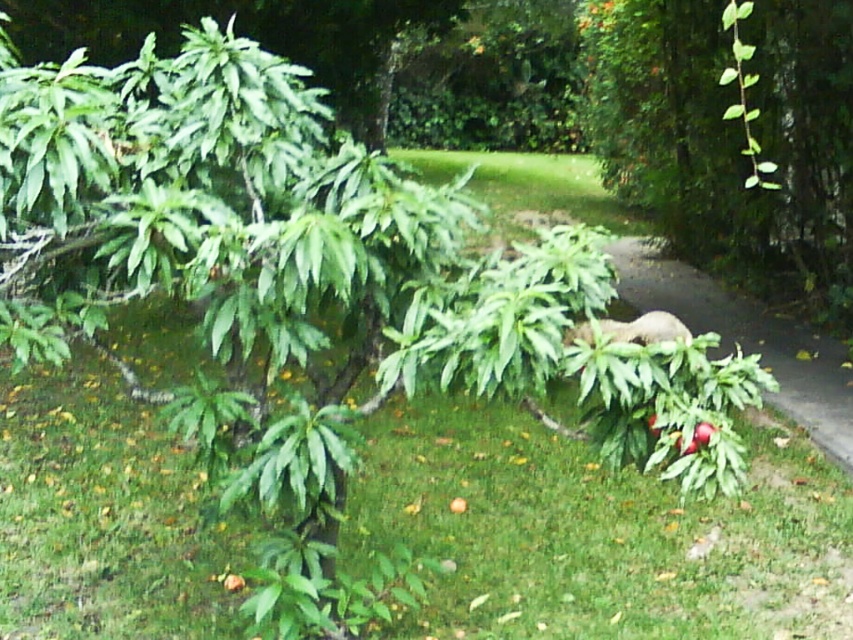
Question: Which point is closer to the camera taking this photo?

Choices:
 (A) (608, 332)
 (B) (819, 253)

Answer: (A)

Question: In this image, where is fuzzy brown bear at center located relative to red matte apple at lower right?

Choices:
 (A) above
 (B) below

Answer: (A)

Question: Among these points, which one is farthest from the camera?

Choices:
 (A) (704, 426)
 (B) (630, 333)

Answer: (B)

Question: Which object appears closest to the camera in this image?

Choices:
 (A) red matte apple at lower right
 (B) green leafy plant at center
 (C) fuzzy brown bear at center

Answer: (A)

Question: Does green leafy plant at center come behind red matte apple at lower right?

Choices:
 (A) no
 (B) yes

Answer: (B)

Question: Does green leafy plant at center appear under fuzzy brown bear at center?

Choices:
 (A) yes
 (B) no

Answer: (B)